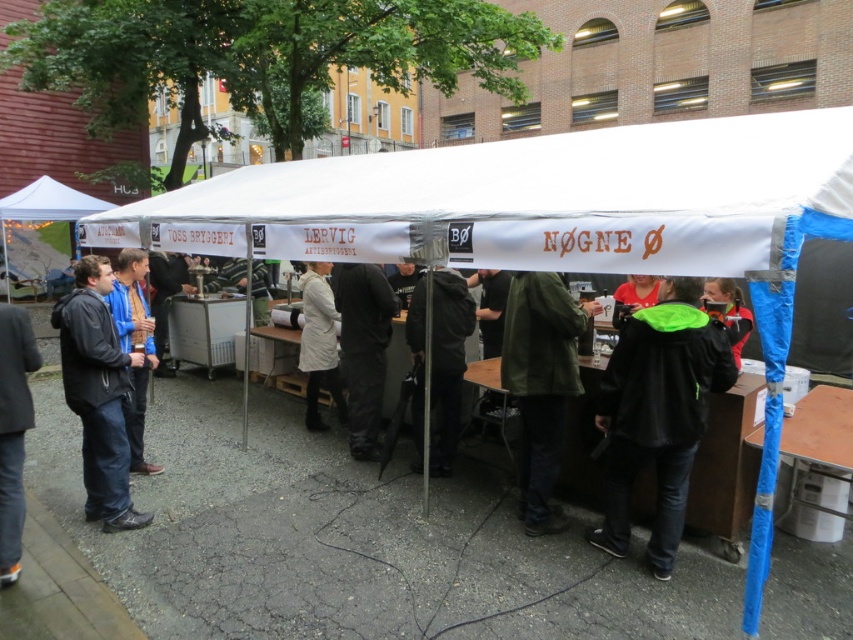
Is point (538, 339) in front of point (76, 272)?

Yes.

Which of these two, green matte jacket at center or dark gray jacket at left, stands shorter?

With less height is green matte jacket at center.

Who is more forward, (x=525, y=490) or (x=91, y=266)?

Point (x=91, y=266)

Identify the location of green matte jacket at center. (541, 384).

Does black matte jacket at lower right appear on the left side of light beige coat at center?

In fact, black matte jacket at lower right is to the right of light beige coat at center.

Image resolution: width=853 pixels, height=640 pixels. What do you see at coordinates (659, 412) in the screenshot?
I see `black matte jacket at lower right` at bounding box center [659, 412].

The width and height of the screenshot is (853, 640). What are the coordinates of `black matte jacket at lower right` in the screenshot? It's located at (659, 412).

Can you confirm if white fabric canopy at center is positioned to the left of light beige coat at center?

No, white fabric canopy at center is not to the left of light beige coat at center.

Is point (509, 150) in front of point (318, 340)?

Yes, it is in front of point (318, 340).

Is point (326, 257) positioned in front of point (317, 336)?

Yes, it is.

I want to click on white fabric canopy at center, so click(x=531, y=198).